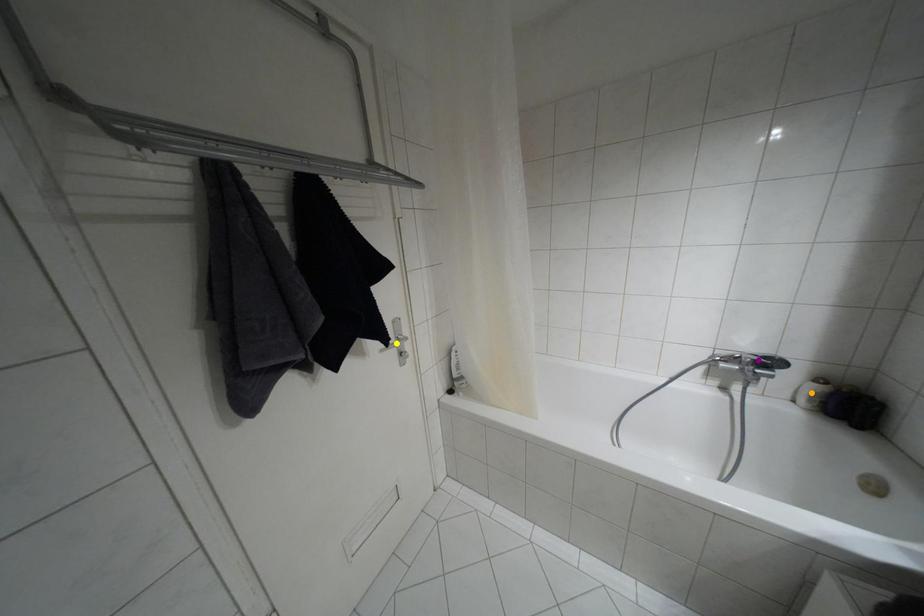
Order these from nearest to farthest:
1. purple point
2. orange point
3. yellow point

orange point
yellow point
purple point